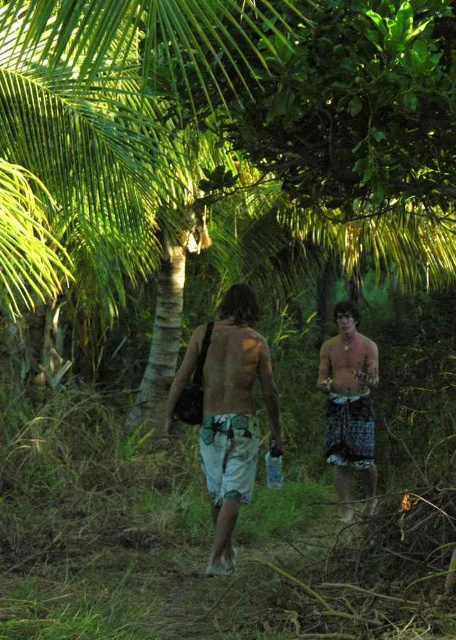
Question: Can you confirm if green patterned shorts at center is positioned below patterned shorts at right?

Choices:
 (A) yes
 (B) no

Answer: (A)

Question: Is the position of green patterned shorts at center less distant than that of patterned shorts at right?

Choices:
 (A) yes
 (B) no

Answer: (B)

Question: Is green patterned shorts at center wider than patterned shorts at right?

Choices:
 (A) no
 (B) yes

Answer: (B)